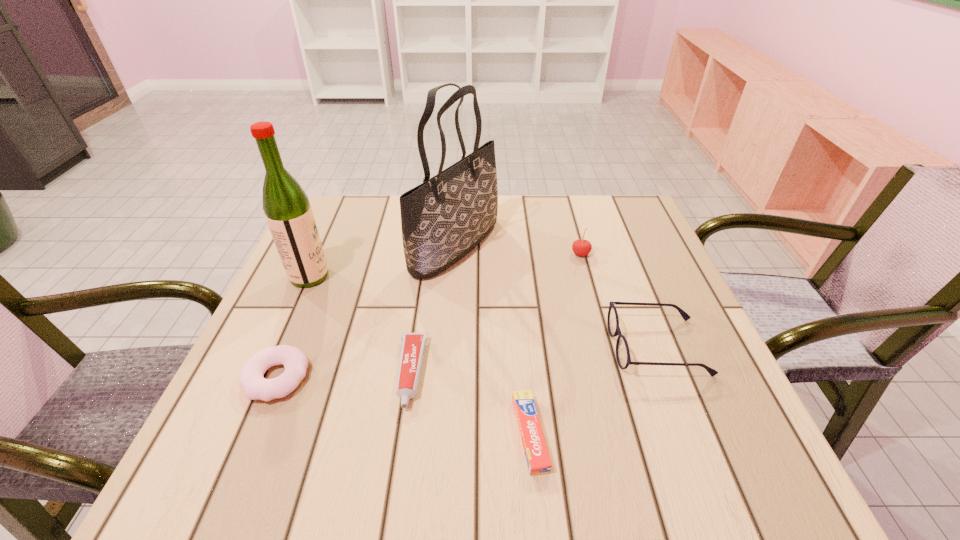
You are a GUI agent. You are given a task and a screenshot of the screen. Output one action in this format:
    pyautogui.click(x=<x>, y=<y>)
    Task: Click on the tote bag
    
    Given the screenshot: What is the action you would take?
    pyautogui.click(x=443, y=219)

Locate an element on the screen. liquor is located at coordinates (288, 212).

Where is `the fifth shortest object`? This screenshot has width=960, height=540. the fifth shortest object is located at coordinates (581, 247).

At what (x,y) coordinates should I click in order to perform the action: click on spectacles. Please return your answer as a coordinate pair (x, y). This screenshot has height=540, width=960. Looking at the image, I should click on (623, 357).

I want to click on the left toothpaste, so click(412, 350).

In order to click on doughnut in this screenshot , I will do `click(256, 387)`.

The image size is (960, 540). I want to click on the shorter toothpaste, so click(538, 461).

The image size is (960, 540). I want to click on the shortest object, so click(538, 461).

Where is `free space located on the right of the tote bag`? The image size is (960, 540). free space located on the right of the tote bag is located at coordinates (526, 246).

Identify the location of free spot located on the label of the liquor. (467, 276).